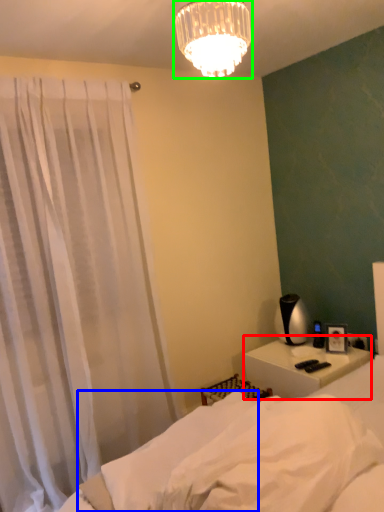
Question: Which object is the closest to the nightstand (highlighted by a red box)? Choose among these: sheet (highlighted by a blue box) or lamp (highlighted by a green box).

Choices:
 (A) sheet
 (B) lamp

Answer: (A)